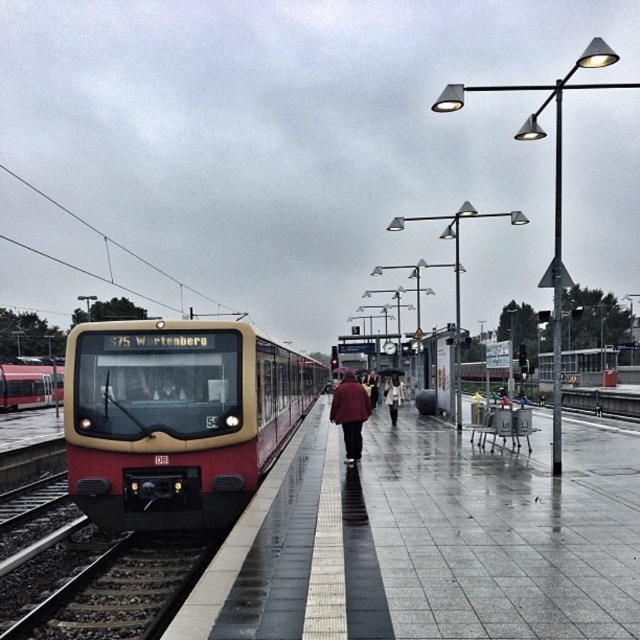
You are a passenger waiting at the train station platform. You see the matte red train at center and the red matte train at left. Which train has a narrower width?

The matte red train at center is thinner than the red matte train at left, so the matte red train at center has a narrower width.

You are standing on the smooth concrete platform at center and want to place your red wool coat at center on it. Considering the size of the platform and the coat, will the coat fit entirely on the platform?

The smooth concrete platform at center is larger than the red wool coat at center, so the coat will fit entirely on the platform.